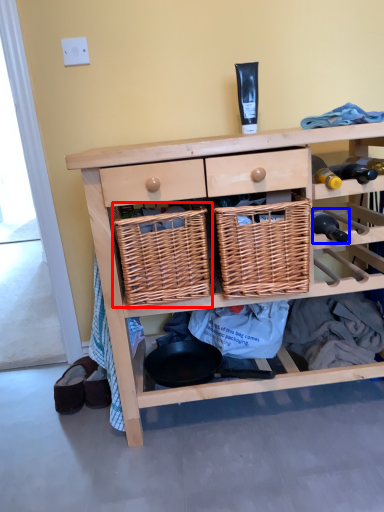
Question: Which point is closer to the camera, basket (highlighted by a red box) or bottle (highlighted by a blue box)?

Choices:
 (A) basket
 (B) bottle

Answer: (A)